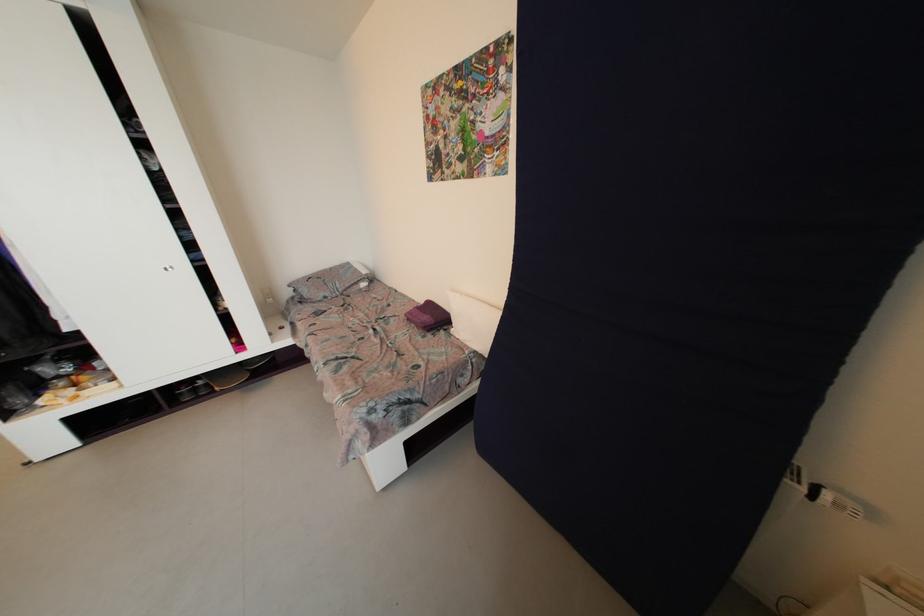
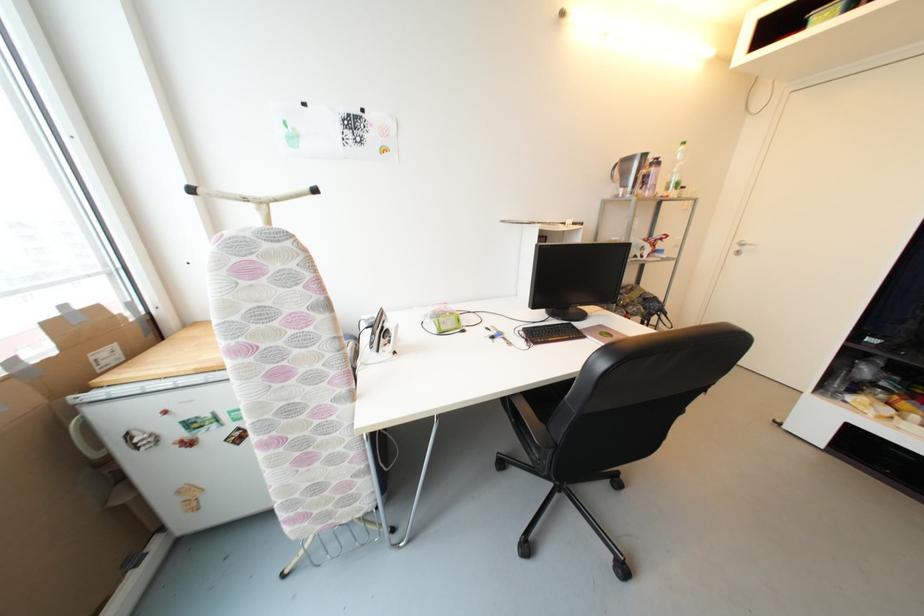
Based on the continuous images, in which direction is the camera rotating?

The camera rotated toward left-down.